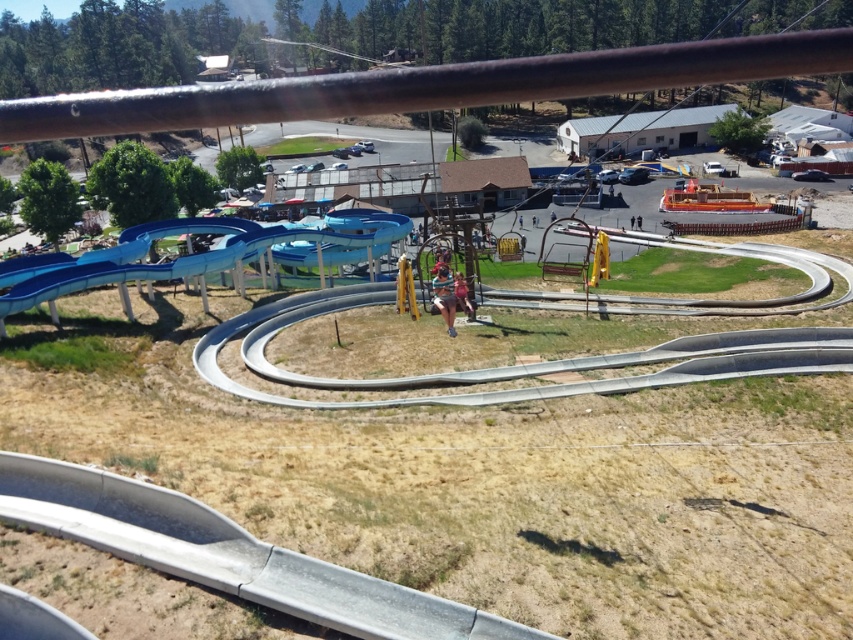
Is point (827, 56) less distant than point (16, 269)?

Yes, point (827, 56) is in front of point (16, 269).

Who is more distant from viewer, (x=845, y=28) or (x=189, y=273)?

The point (x=845, y=28) is more distant.

Is point (155, 109) in front of point (131, 234)?

Yes, point (155, 109) is in front of point (131, 234).

Where is `rusty metal rail at upper center`? rusty metal rail at upper center is located at coordinates (427, 86).